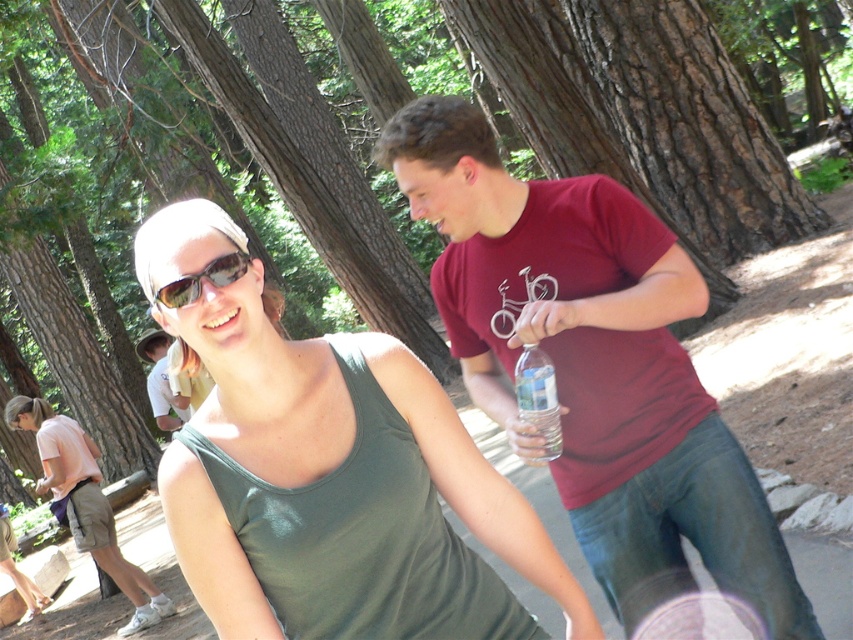
Question: In this image, where is green fabric tank top at center located relative to clear plastic bottle at center?

Choices:
 (A) below
 (B) above

Answer: (A)

Question: Which point appears closest to the camera in this image?

Choices:
 (A) (582, 348)
 (B) (363, 346)
 (C) (198, 294)

Answer: (C)

Question: Which of the following is the closest to the observer?

Choices:
 (A) (24, 397)
 (B) (590, 365)
 (C) (206, 269)
 (D) (314, 390)

Answer: (C)

Question: Is green fabric tank top at center further to the viewer compared to clear plastic bottle at center?

Choices:
 (A) yes
 (B) no

Answer: (A)

Question: Is matte red t-shirt at center wider than clear plastic bottle at center?

Choices:
 (A) yes
 (B) no

Answer: (A)

Question: Which of these objects is positioned closest to the sunglasses at center?

Choices:
 (A) matte red t-shirt at center
 (B) clear plastic bottle at center
 (C) green fabric tank top at center
 (D) green matte tank top at center

Answer: (D)